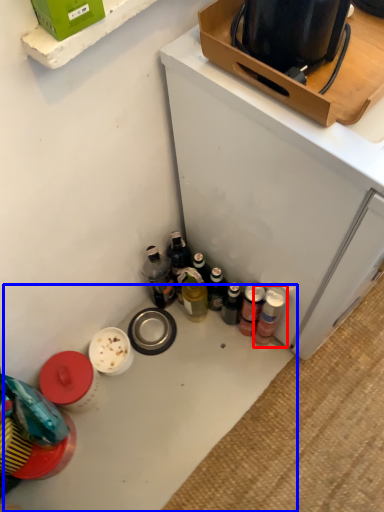
Question: Which of the following is the closest to the observer, bottle (highlighted by a red box) or table (highlighted by a blue box)?

Choices:
 (A) bottle
 (B) table

Answer: (B)